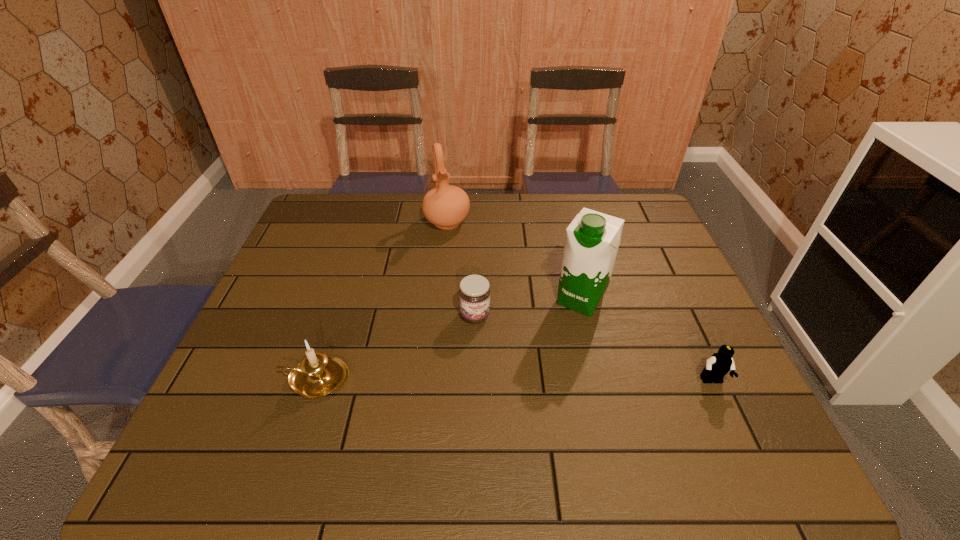
The width and height of the screenshot is (960, 540). Find the location of `candle holder`. candle holder is located at coordinates (317, 375).

Locate an element on the screen. The image size is (960, 540). the third tallest object is located at coordinates (317, 375).

Where is `the rightmost object`? The height and width of the screenshot is (540, 960). the rightmost object is located at coordinates (719, 364).

Where is `soya milk`? Image resolution: width=960 pixels, height=540 pixels. soya milk is located at coordinates (592, 239).

The width and height of the screenshot is (960, 540). Find the location of `jam`. jam is located at coordinates (474, 293).

I want to click on the farthest object, so pyautogui.click(x=445, y=206).

Find the location of `blank area located 0.100m on the handle side of the leftmost object`. blank area located 0.100m on the handle side of the leftmost object is located at coordinates (238, 379).

Where is `free location located on the handle side of the leftmost object`? The width and height of the screenshot is (960, 540). free location located on the handle side of the leftmost object is located at coordinates (229, 379).

This screenshot has width=960, height=540. I want to click on vacant region located on the front-facing side of the rightmost object, so click(727, 413).

Image resolution: width=960 pixels, height=540 pixels. Find the location of `vacant space situated 0.150m on the front-facing side of the soya milk`. vacant space situated 0.150m on the front-facing side of the soya milk is located at coordinates (545, 355).